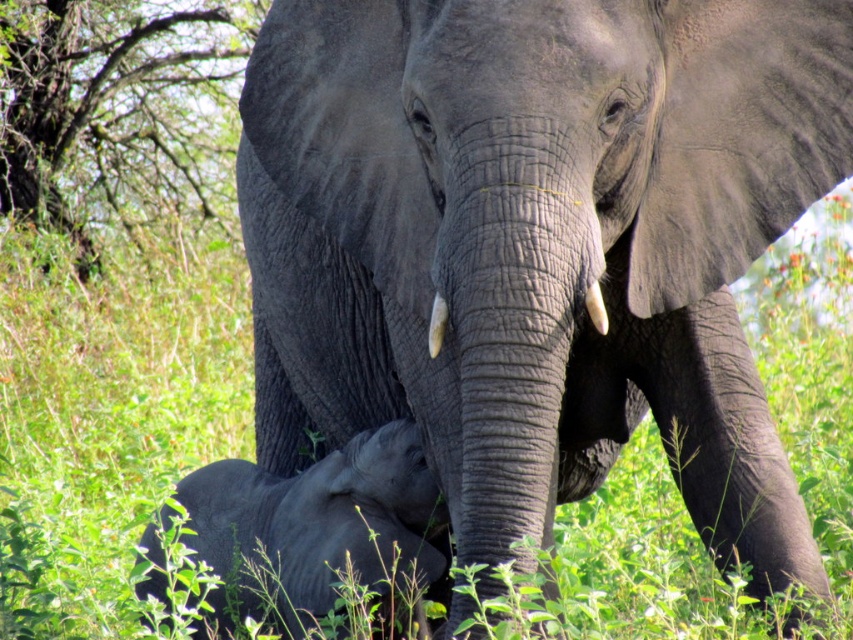
You are a photographer trying to capture a photo of the gray matte elephant at lower left without the green leafy tree at upper left blocking the view. Based on their positions, can you position yourself in a way to frame the elephant without the tree in the shot?

The green leafy tree at upper left is above the gray matte elephant at lower left, so positioning yourself lower and facing upward might allow you to capture the gray matte elephant at lower left without the tree obstructing the view.

Based on the scene description, where is the green leafy tree at upper left located in terms of its 2D coordinates?

The green leafy tree at upper left is located at the 2D coordinates point (112, 108).

You are a wildlife photographer trying to capture a photo of the gray matte elephant at center and the gray matte elephant at lower left. Which elephant should you focus on if you want to photograph the taller one?

The gray matte elephant at center is taller than the gray matte elephant at lower left, so you should focus on the gray matte elephant at center to photograph the taller one.